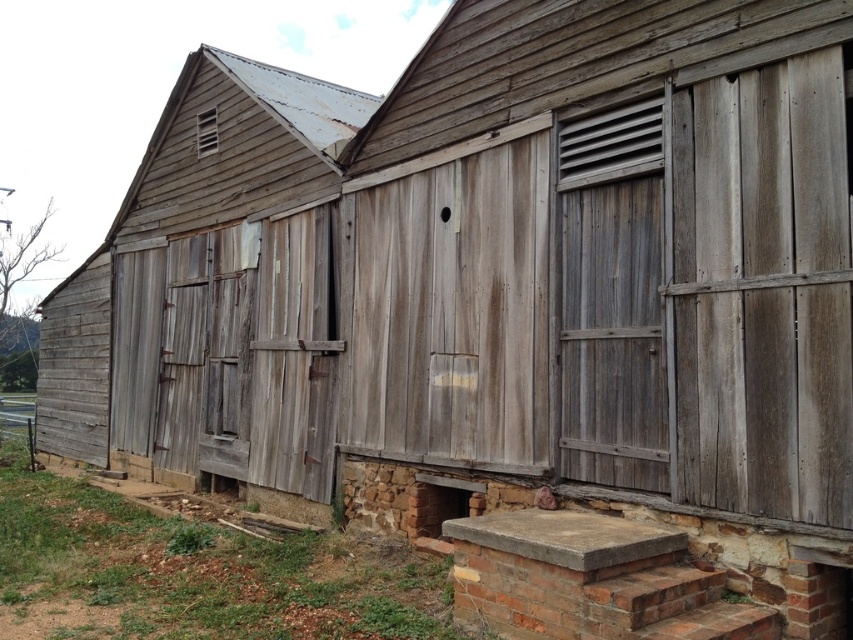
This screenshot has height=640, width=853. I want to click on weathered wood shutter at center, so click(294, 356).

The image size is (853, 640). What do you see at coordinates (294, 356) in the screenshot?
I see `weathered wood shutter at center` at bounding box center [294, 356].

Between point (299, 218) and point (209, 129), which one is positioned behind?

The point (209, 129) is more distant.

The width and height of the screenshot is (853, 640). Identify the location of weathered wood shutter at center. (294, 356).

Who is taller, weathered wood shutter at right or weathered wood shutter at center?

weathered wood shutter at center is taller.

Between weathered wood shutter at right and weathered wood shutter at center, which one appears on the right side from the viewer's perspective?

From the viewer's perspective, weathered wood shutter at right appears more on the right side.

Is point (590, 262) closer to camera compared to point (306, 413)?

Yes, it is.

This screenshot has height=640, width=853. I want to click on weathered wood shutter at right, so click(611, 298).

Can you confirm if weathered wood barn at left is shorter than weathered wood shutter at center?

In fact, weathered wood barn at left may be taller than weathered wood shutter at center.

Is point (173, 248) less distant than point (265, 262)?

No, it is not.

Locate an element on the screen. The width and height of the screenshot is (853, 640). weathered wood barn at left is located at coordinates (212, 296).